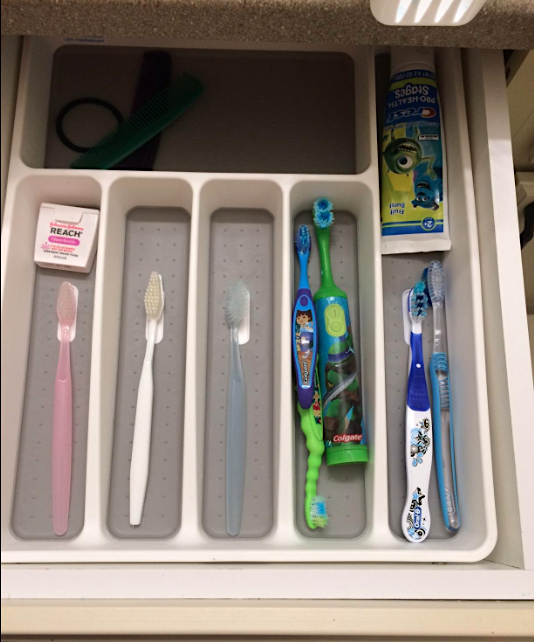
At what (x,y) coordinates should I click in order to perform the action: click on organizer. Please return your answer as a coordinate pair (x, y). The image size is (534, 642). Looking at the image, I should click on click(x=354, y=180).